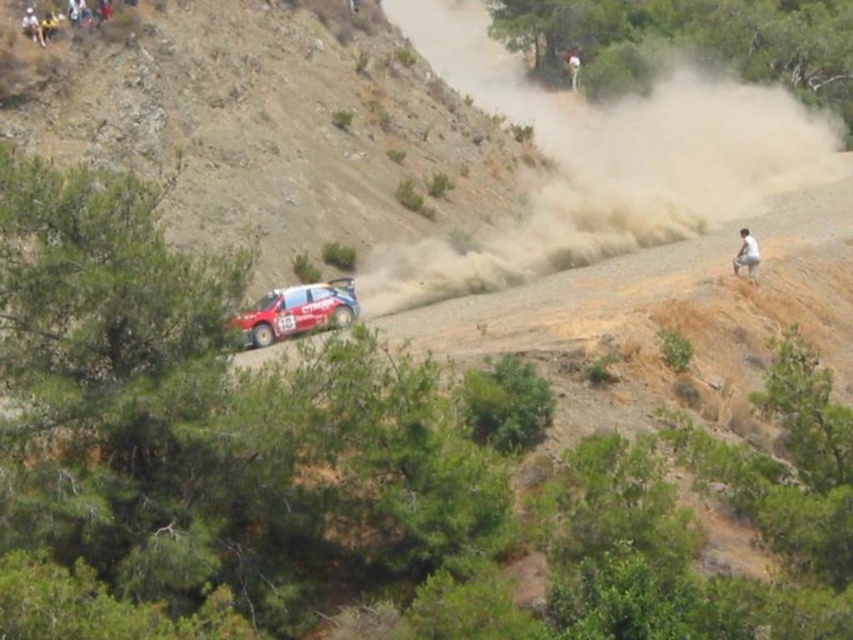
Which is more to the left, brown dusty cloud at right or white fabric person at upper left?

white fabric person at upper left is more to the left.

Is the position of brown dusty cloud at right less distant than that of white fabric person at upper left?

Yes, it is.

Is point (589, 104) positioned after point (33, 17)?

Yes, point (589, 104) is farther from viewer.

Image resolution: width=853 pixels, height=640 pixels. I want to click on brown dusty cloud at right, so click(x=601, y=163).

Is white cotton shirt at lower right positioned in front of white fabric person at upper center?

That is True.

Is point (747, 234) positioned behind point (573, 61)?

No, (747, 234) is in front of (573, 61).

The image size is (853, 640). Find the location of `white cotton shirt at lower right`. white cotton shirt at lower right is located at coordinates (746, 253).

Which is above, red matte rally car at center or white fabric person at upper left?

Positioned higher is white fabric person at upper left.

Which is below, red matte rally car at center or white fabric person at upper left?

red matte rally car at center is below.

Is point (252, 316) farther from viewer compared to point (30, 13)?

No.

Where is `red matte rally car at center`? The width and height of the screenshot is (853, 640). red matte rally car at center is located at coordinates (297, 310).